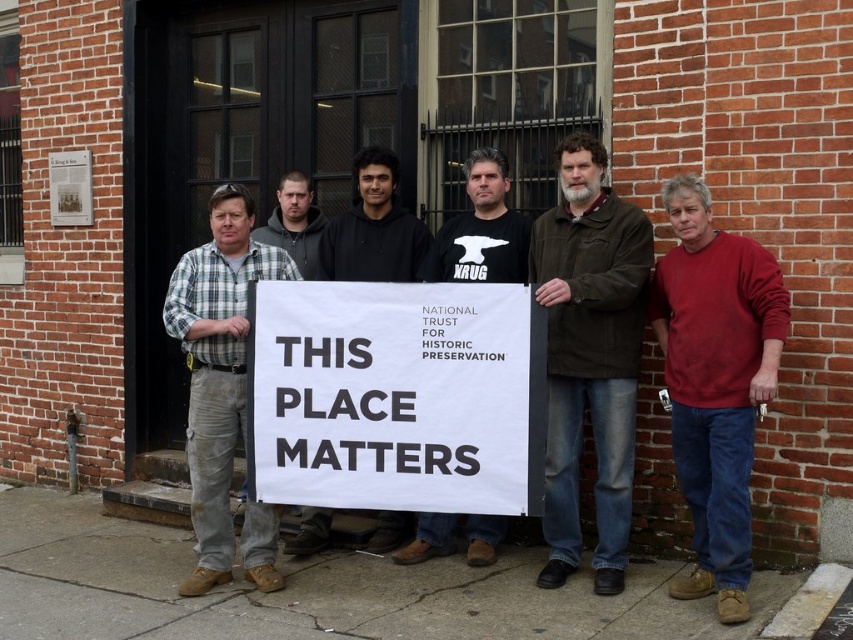
From the picture: You are a photographer trying to capture the dark brown leather jacket at center and the black matte shirt at center in the same frame. Which one is lower in the photo?

The dark brown leather jacket at center is positioned under the black matte shirt at center, so it is lower in the photo.

Looking at this image, you are standing in front of the brick building with the group holding the large white sign. There is a point at coordinates (482, 228). What object is located at that point?

The point at coordinates 0.356, 0.566 corresponds to the black matte shirt at center.